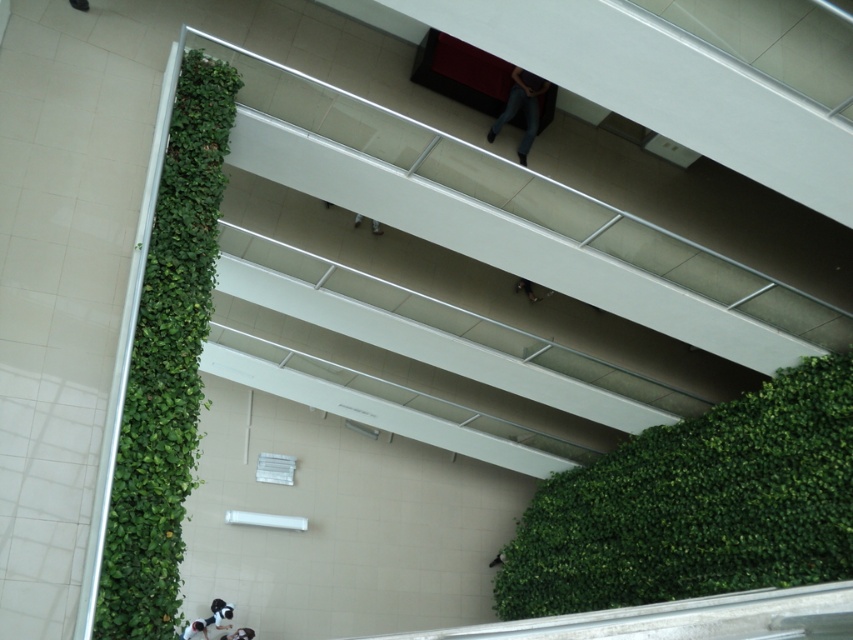
Can you confirm if green leafy wall at lower right is shorter than green leafy wall at left?

Indeed, green leafy wall at lower right has a lesser height compared to green leafy wall at left.

Is green leafy wall at lower right wider than green leafy wall at left?

Indeed, green leafy wall at lower right has a greater width compared to green leafy wall at left.

Locate an element on the screen. green leafy wall at lower right is located at coordinates (697, 506).

Can you confirm if green leafy wall at lower right is positioned below denim jeans at upper center?

Yes, green leafy wall at lower right is below denim jeans at upper center.

Is point (560, 579) farther from viewer compared to point (508, 109)?

Yes.

What do you see at coordinates (697, 506) in the screenshot? The width and height of the screenshot is (853, 640). I see `green leafy wall at lower right` at bounding box center [697, 506].

I want to click on green leafy wall at lower right, so click(x=697, y=506).

Looking at this image, who is higher up, green leafy wall at left or denim jeans at upper center?

Positioned higher is denim jeans at upper center.

Is green leafy wall at left thinner than denim jeans at upper center?

Indeed, green leafy wall at left has a lesser width compared to denim jeans at upper center.

This screenshot has width=853, height=640. Describe the element at coordinates (166, 364) in the screenshot. I see `green leafy wall at left` at that location.

The height and width of the screenshot is (640, 853). I want to click on green leafy wall at left, so click(166, 364).